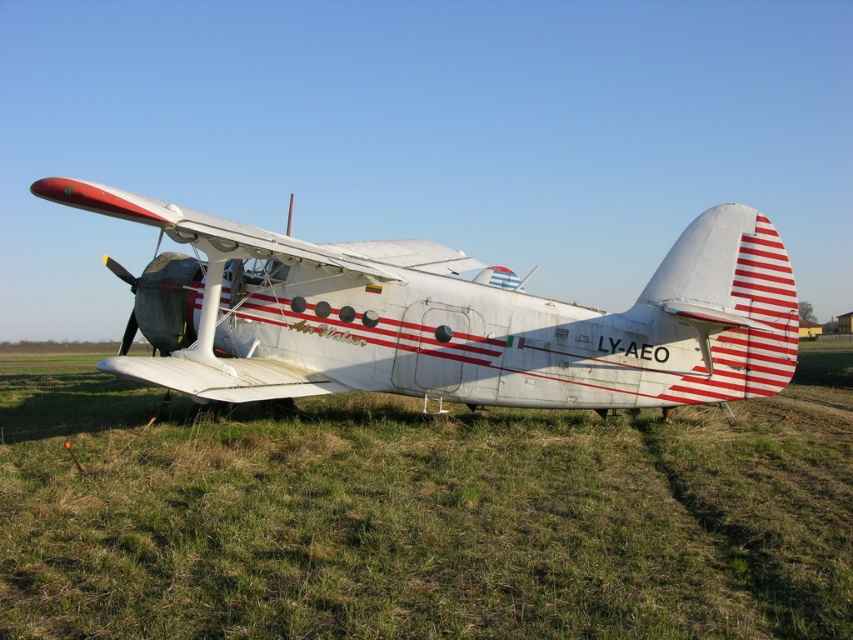
Question: Is green grass at lower center further to camera compared to white matte airplane at center?

Choices:
 (A) no
 (B) yes

Answer: (A)

Question: In this image, where is green grass at lower center located relative to white matte airplane at center?

Choices:
 (A) left
 (B) right

Answer: (A)

Question: Which object appears closest to the camera in this image?

Choices:
 (A) green grass at lower center
 (B) white matte airplane at center

Answer: (A)

Question: Which object appears farthest from the camera in this image?

Choices:
 (A) white matte airplane at center
 (B) green grass at lower center

Answer: (A)

Question: Can you confirm if green grass at lower center is positioned below white matte airplane at center?

Choices:
 (A) no
 (B) yes

Answer: (B)